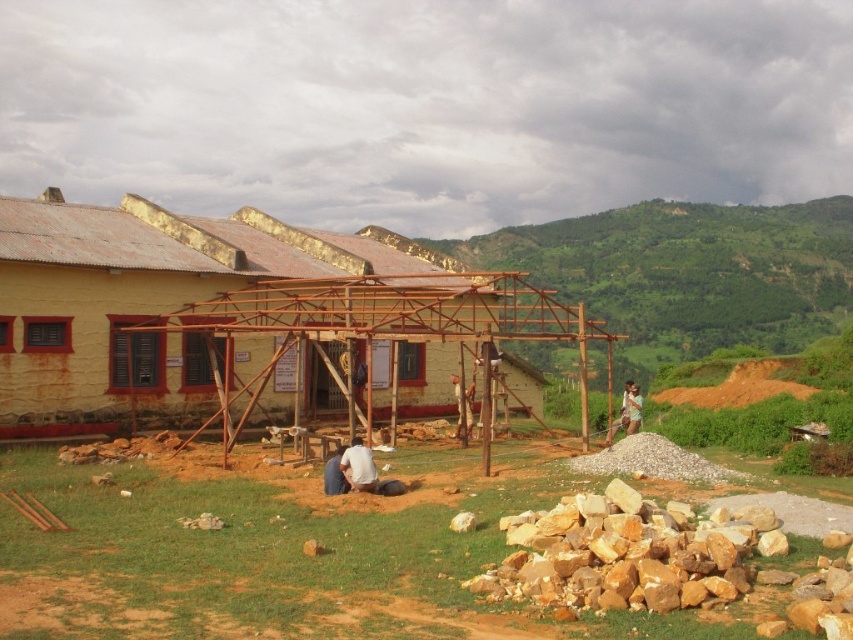
Does yellow painted wood at center appear on the left side of green fabric shirt at center?

Indeed, yellow painted wood at center is positioned on the left side of green fabric shirt at center.

Which is in front, point (108, 225) or point (625, 412)?

Positioned in front is point (625, 412).

Between point (19, 332) and point (637, 397), which one is positioned behind?

The point (637, 397) is more distant.

Find the location of `yellow painted wood at center`. yellow painted wood at center is located at coordinates (142, 301).